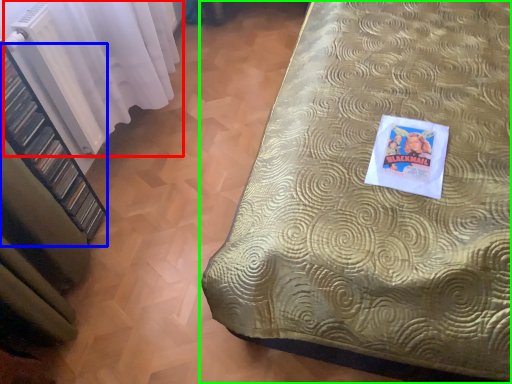
Question: Which object is positioned closest to curtain (highlighted by a red box)? Select from shelf (highlighted by a blue box) and bed (highlighted by a green box).

Choices:
 (A) shelf
 (B) bed

Answer: (A)